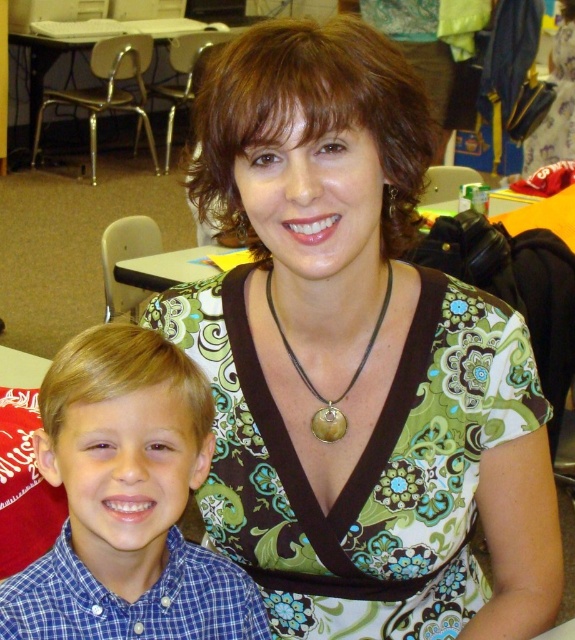
Question: Which object appears closest to the camera in this image?

Choices:
 (A) green patterned blouse at center
 (B) green floral dress at center

Answer: (A)

Question: From the image, what is the correct spatial relationship of metallic silver table at upper left in relation to leather cord pendant at center?

Choices:
 (A) left
 (B) right

Answer: (A)

Question: Which of these objects is positioned closest to the leather cord pendant at center?

Choices:
 (A) green patterned blouse at center
 (B) metallic silver table at upper left

Answer: (A)

Question: Is blue checkered shirt at lower left wider than leather cord pendant at center?

Choices:
 (A) yes
 (B) no

Answer: (A)

Question: Observing the image, what is the correct spatial positioning of blue checkered shirt at lower left in reference to leather cord pendant at center?

Choices:
 (A) right
 (B) left

Answer: (B)

Question: Which object is farther from the camera taking this photo?

Choices:
 (A) leather cord pendant at center
 (B) blue checkered shirt at lower left

Answer: (A)